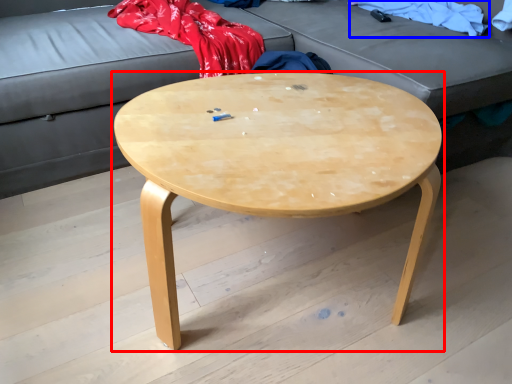
Question: Which point is further to the camera, coffee table (highlighted by a red box) or clothing (highlighted by a blue box)?

Choices:
 (A) coffee table
 (B) clothing

Answer: (B)